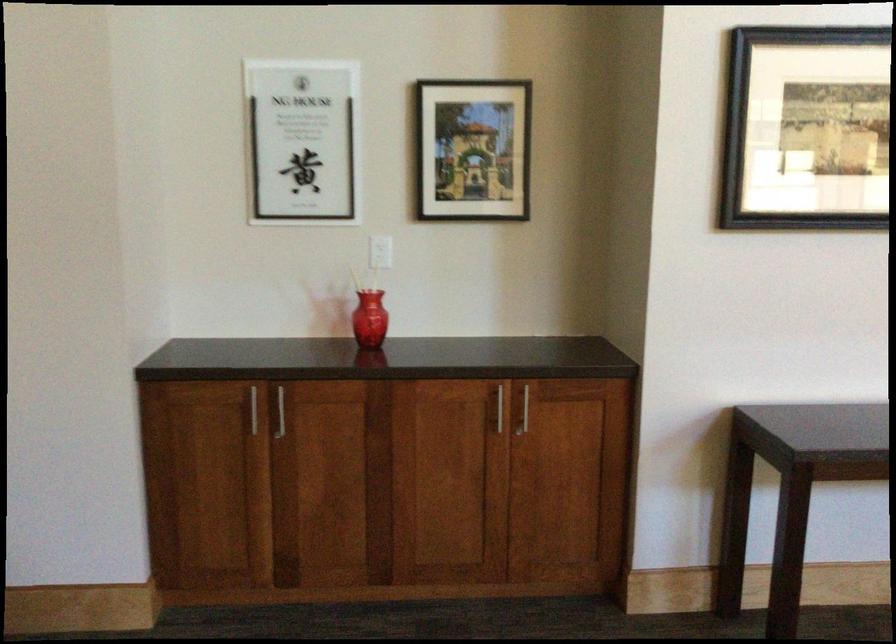
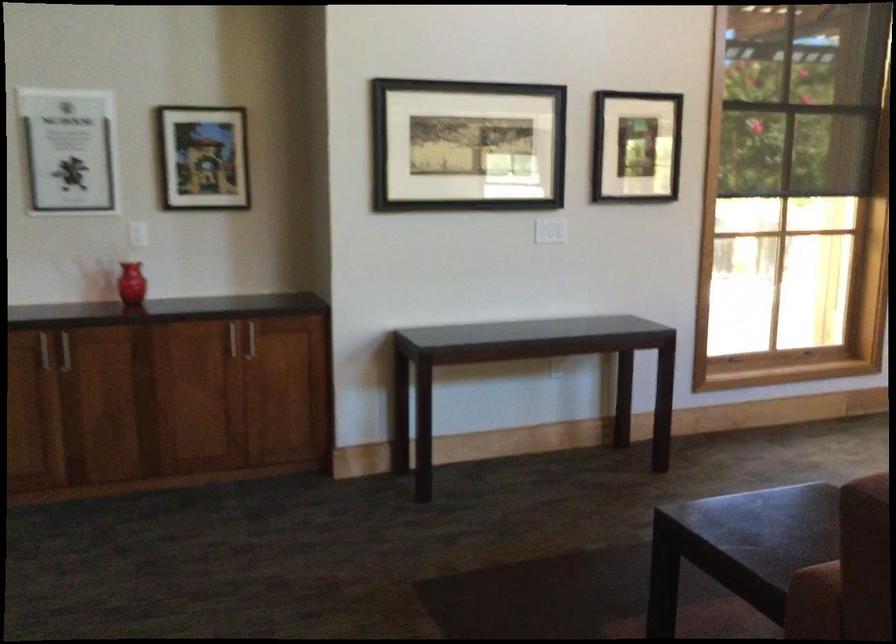
Question: Which direction would the cameraman need to move to produce the second image? Reply with the corresponding letter.

Choices:
 (A) Left
 (B) Right
 (C) Forward
 (D) Backward

Answer: (D)